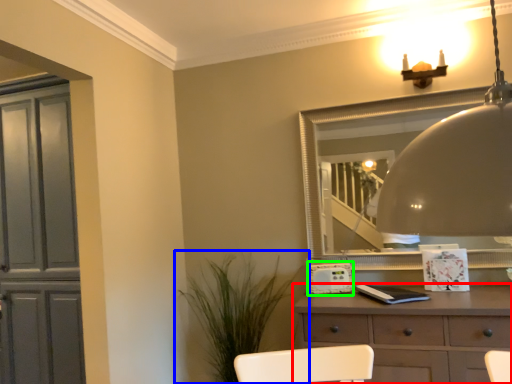
Question: Which object is positioned closest to chest of drawers (highlighted by a red box)? Select from houseplant (highlighted by a blue box) and appliance (highlighted by a green box).

Choices:
 (A) houseplant
 (B) appliance

Answer: (B)